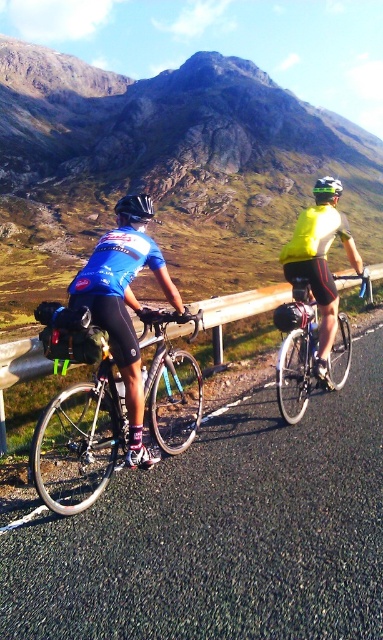
Is shiny black frame at left shorter than yellow matte bicycle helmet at upper center?

Yes.

Is point (117, 436) positioned before point (320, 189)?

Yes, it is in front of point (320, 189).

This screenshot has width=383, height=640. Identify the location of shiny black frame at left. (80, 440).

Is shiny black frame at left further to the viewer compared to shiny silver bicycle at right?

No, it is in front of shiny silver bicycle at right.

Who is positioned more to the left, shiny black frame at left or shiny silver bicycle at right?

shiny black frame at left

Is point (173, 374) closer to viewer compared to point (289, 346)?

Yes.

This screenshot has width=383, height=640. In order to click on shiny black frame at left in this screenshot , I will do `click(80, 440)`.

Between point (127, 496) and point (304, 310), which one is positioned in front?

Point (127, 496)

Does black asphalt road at center appear on the left side of shiny silver bicycle at right?

Indeed, black asphalt road at center is positioned on the left side of shiny silver bicycle at right.

Which is in front, point (342, 605) or point (366, 289)?

Point (342, 605) is in front.

Where is `black asphalt road at center`? The width and height of the screenshot is (383, 640). black asphalt road at center is located at coordinates (222, 532).